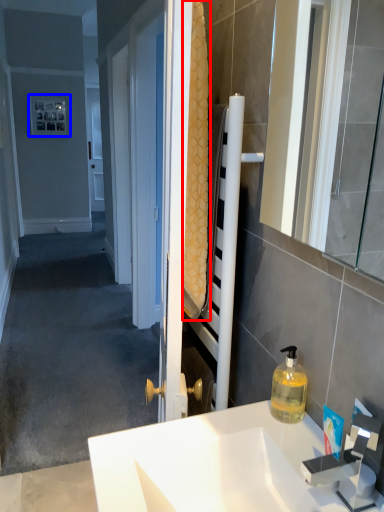
Question: Which of the following is the farthest to the observer, bath towel (highlighted by a red box) or picture frame (highlighted by a blue box)?

Choices:
 (A) bath towel
 (B) picture frame

Answer: (B)